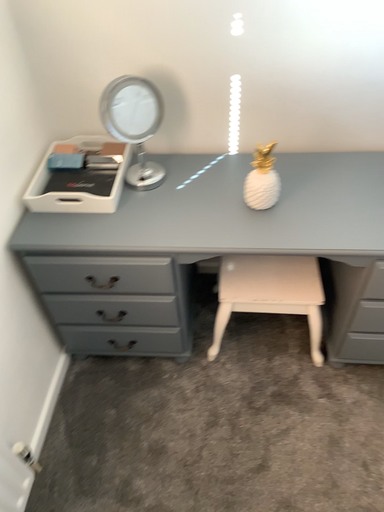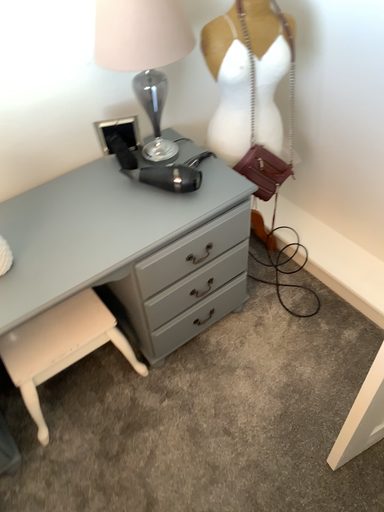
Question: Which way did the camera rotate in the video?

Choices:
 (A) rotated upward
 (B) rotated downward

Answer: (A)